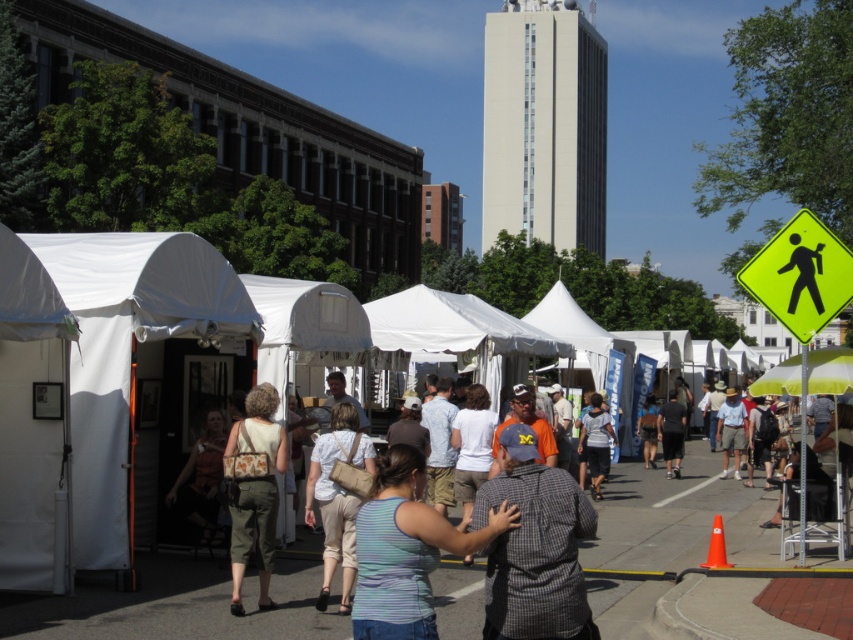
Is camouflage-patterned bag at center wider than black fabric at center?

No, camouflage-patterned bag at center is not wider than black fabric at center.

Can you confirm if camouflage-patterned bag at center is positioned to the left of black fabric at center?

Yes, camouflage-patterned bag at center is to the left of black fabric at center.

At what (x,y) coordinates should I click in order to perform the action: click on camouflage-patterned bag at center. Please return your answer as a coordinate pair (x, y). This screenshot has height=640, width=853. Looking at the image, I should click on (254, 492).

At what (x,y) coordinates should I click in order to perform the action: click on camouflage-patterned bag at center. Please return your answer as a coordinate pair (x, y). Looking at the image, I should click on (254, 492).

Is point (820, 305) in front of point (596, 392)?

Yes, it is.

Between yellow reflective plastic pedestrian crossing sign at upper right and white cotton shirt at center, which one is positioned higher?

Positioned higher is yellow reflective plastic pedestrian crossing sign at upper right.

Is point (778, 250) behind point (604, 419)?

No.

Locate an element on the screen. The height and width of the screenshot is (640, 853). yellow reflective plastic pedestrian crossing sign at upper right is located at coordinates (799, 275).

Image resolution: width=853 pixels, height=640 pixels. Identify the location of white cotton shirt at center. (596, 442).

Does white cotton shirt at center have a smaller size compared to black fabric at center?

Yes.

Between point (596, 464) and point (666, 400), which one is positioned behind?

The point (666, 400) is behind.

Locate an element on the screen. Image resolution: width=853 pixels, height=640 pixels. white cotton shirt at center is located at coordinates (596, 442).